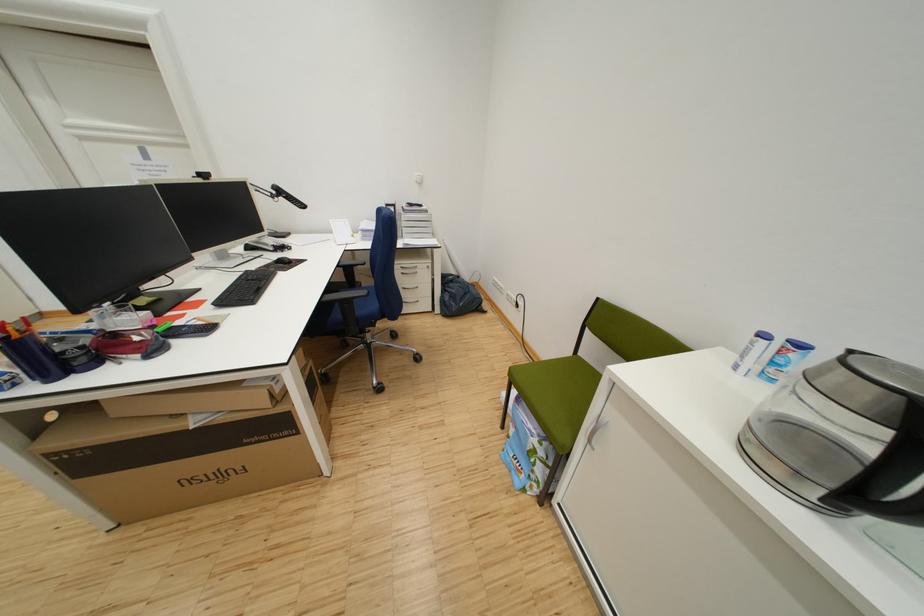
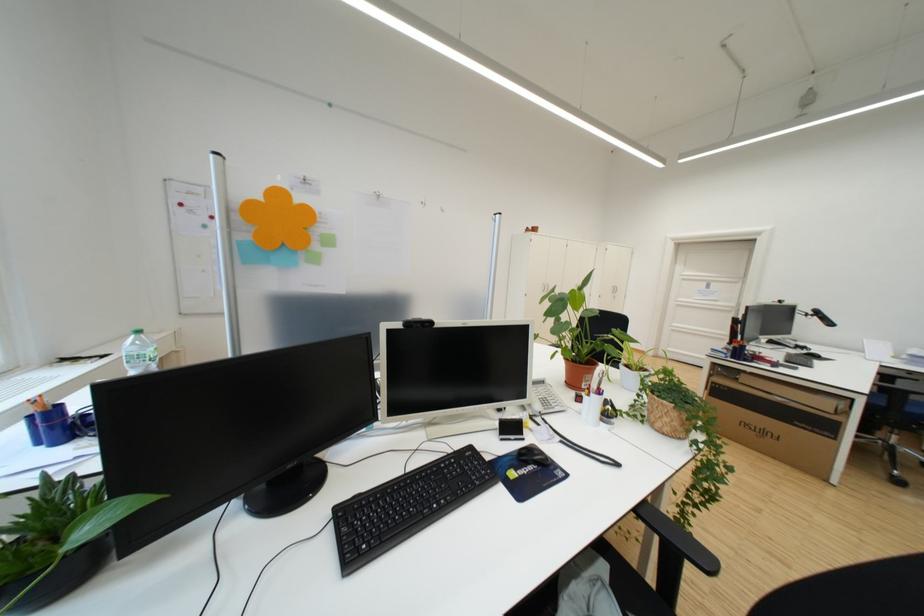
Locate, in the second image, the point that corresponds to [159,158] in the first image.

(720, 288)